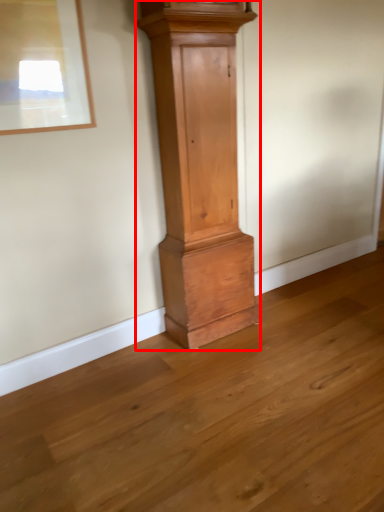
Question: From the image's perspective, what is the correct spatial relationship of furniture (annotated by the red box) in relation to picture frame?

Choices:
 (A) above
 (B) below

Answer: (B)